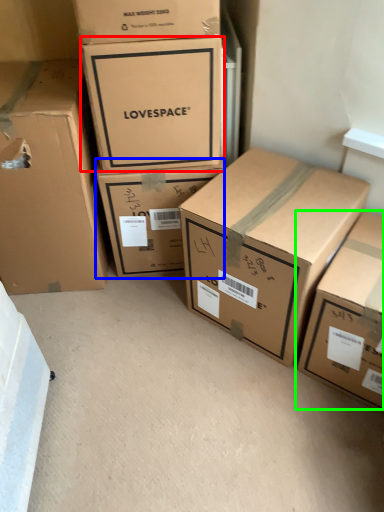
Question: Based on their relative distances, which object is nearer to box (highlighted by a red box)? Choose from box (highlighted by a blue box) and box (highlighted by a green box).

Choices:
 (A) box
 (B) box

Answer: (A)